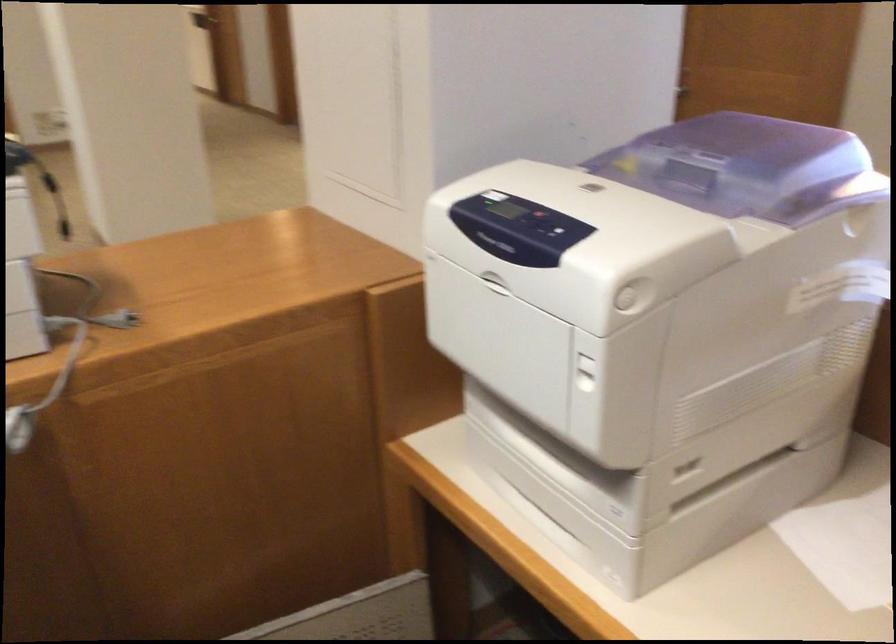
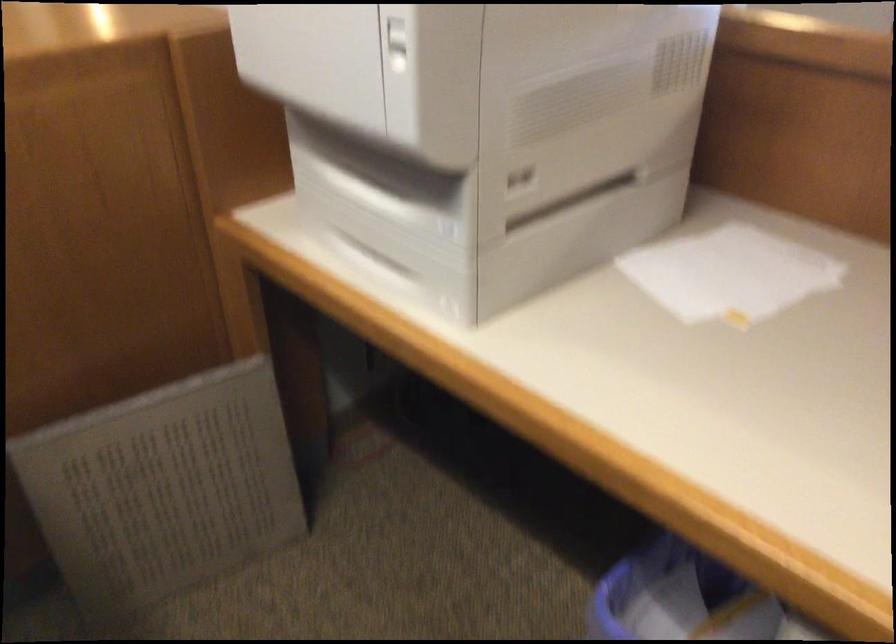
Locate, in the second image, the point that corresponds to (589,373) in the first image.

(397, 44)